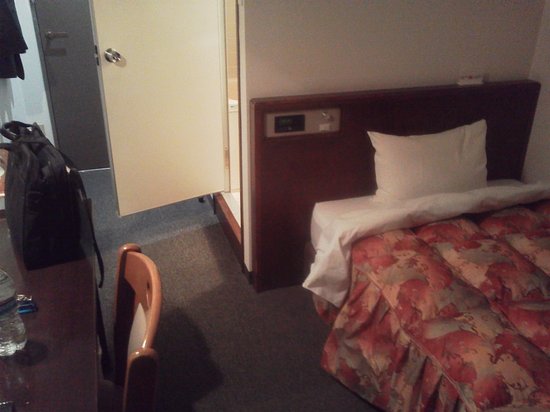
This screenshot has width=550, height=412. What are the coordinates of `carpet` in the screenshot? It's located at (207, 293).